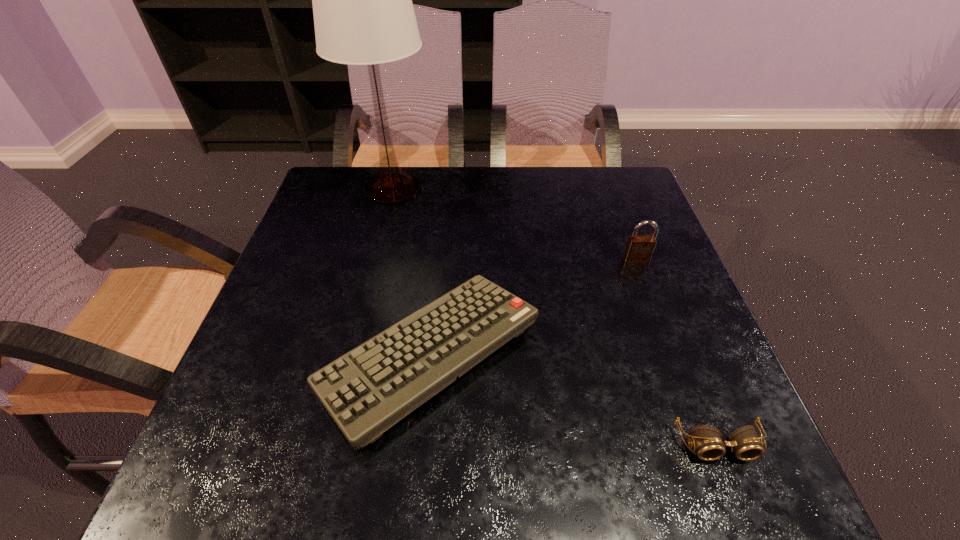
At what (x,y) coordinates should I click in order to perform the action: click on computer keyboard present at the near edge. Please return your answer as a coordinate pair (x, y). The height and width of the screenshot is (540, 960). Looking at the image, I should click on (366, 391).

Locate an element on the screen. This screenshot has height=540, width=960. goggles that is at the near edge is located at coordinates (744, 442).

The image size is (960, 540). Identify the location of table lamp at the left edge. (363, 13).

This screenshot has width=960, height=540. I want to click on computer keyboard positioned at the left edge, so click(366, 391).

The height and width of the screenshot is (540, 960). What are the coordinates of `padlock at the right edge` in the screenshot? It's located at (639, 249).

I want to click on goggles that is at the right edge, so click(x=744, y=442).

You are a GUI agent. You are given a task and a screenshot of the screen. Output one action in this format:
    pyautogui.click(x=<x>, y=<y>)
    Task: Click on the object that is at the far left corner
    The height and width of the screenshot is (540, 960).
    Given the screenshot: What is the action you would take?
    pyautogui.click(x=363, y=13)

Locate an element on the screen. object situated at the near left corner is located at coordinates (366, 391).

Identify the location of object at the near right corner. coord(744,442).

Locate an element on the screen. free region at the far edge is located at coordinates (553, 182).